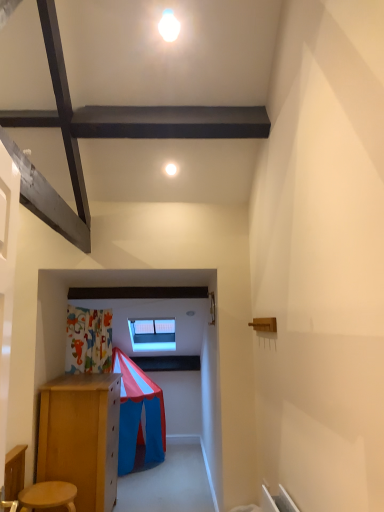
Question: Can you confirm if white glossy light at upper center is positioned to the left of wooden stool at lower left?

Choices:
 (A) no
 (B) yes

Answer: (A)

Question: Does white glossy light at upper center have a smaller size compared to wooden stool at lower left?

Choices:
 (A) no
 (B) yes

Answer: (B)

Question: Considering the relative sizes of white glossy light at upper center and wooden stool at lower left in the image provided, is white glossy light at upper center shorter than wooden stool at lower left?

Choices:
 (A) no
 (B) yes

Answer: (B)

Question: From the image's perspective, does white glossy light at upper center appear higher than wooden stool at lower left?

Choices:
 (A) no
 (B) yes

Answer: (B)

Question: Is white glossy light at upper center taller than wooden stool at lower left?

Choices:
 (A) yes
 (B) no

Answer: (B)

Question: Is white glossy light at upper center placed right next to wooden stool at lower left?

Choices:
 (A) no
 (B) yes

Answer: (A)

Question: Is white glossy light at upper center not near transparent glass window at center?

Choices:
 (A) yes
 (B) no

Answer: (A)

Question: Is white glossy light at upper center closer to camera compared to transparent glass window at center?

Choices:
 (A) no
 (B) yes

Answer: (B)

Question: Does white glossy light at upper center have a larger size compared to transparent glass window at center?

Choices:
 (A) yes
 (B) no

Answer: (B)

Question: Is white glossy light at upper center looking in the opposite direction of transparent glass window at center?

Choices:
 (A) yes
 (B) no

Answer: (B)

Question: Is white glossy light at upper center behind transparent glass window at center?

Choices:
 (A) no
 (B) yes

Answer: (A)

Question: From a real-world perspective, is white glossy light at upper center located higher than transparent glass window at center?

Choices:
 (A) yes
 (B) no

Answer: (A)

Question: From the image's perspective, is transparent glass window at center beneath wooden stool at lower left?

Choices:
 (A) no
 (B) yes

Answer: (A)